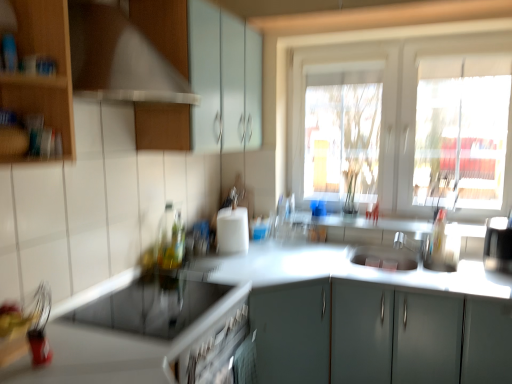
Identify the location of free space in front of translucent glass bottle at center, marked as the first bottle in a back-to-front arrangement. (187, 269).